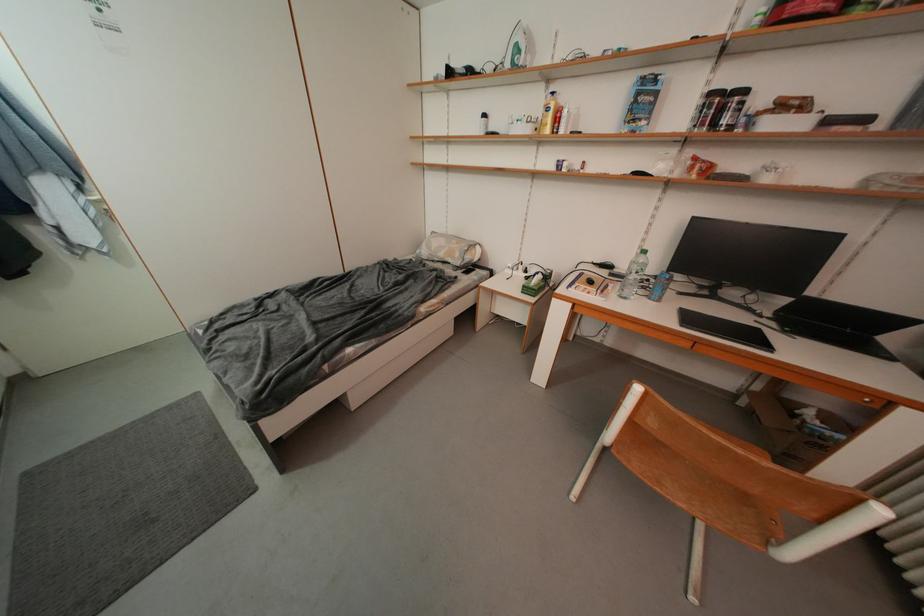
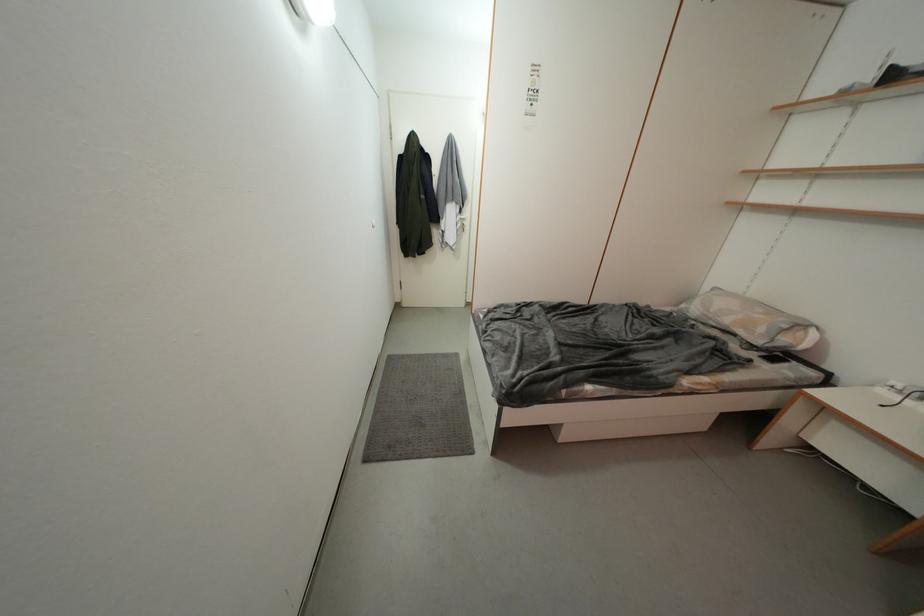
In the second image, find the point that corresponds to [58,196] in the first image.

(457, 216)